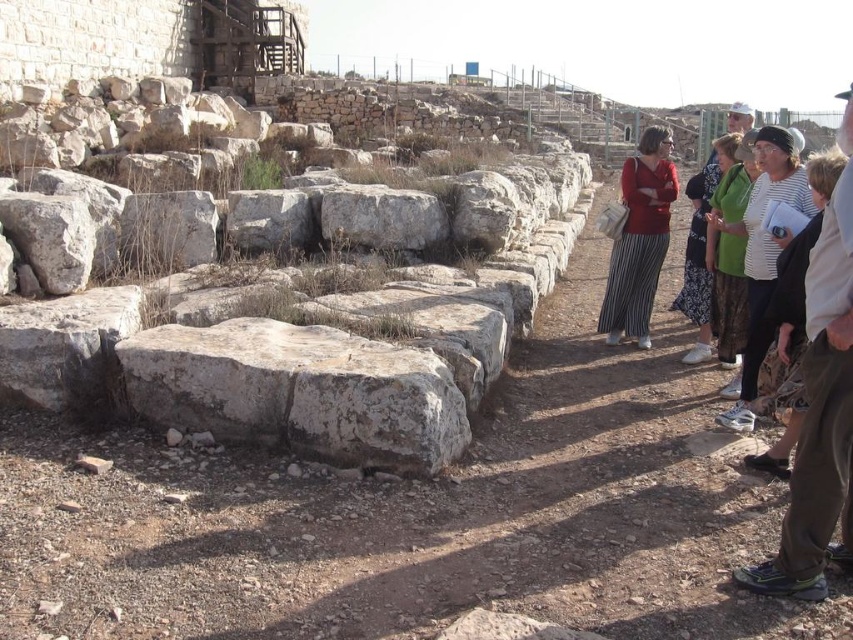
Question: Does gray stone boulder at left have a lesser width compared to striped fabric at right?

Choices:
 (A) no
 (B) yes

Answer: (A)

Question: Which object appears closest to the camera in this image?

Choices:
 (A) striped fabric jacket at right
 (B) green textured sweater at right
 (C) red matte sweater at center

Answer: (A)

Question: Is gray stone boulder at left behind striped fabric jacket at right?

Choices:
 (A) yes
 (B) no

Answer: (A)

Question: Which point is closer to the camera taking this photo?

Choices:
 (A) (848, 304)
 (B) (403, 294)
 (C) (635, 310)
 (D) (802, 211)

Answer: (A)

Question: Is gray stone boulder at left above striped fabric jacket at right?

Choices:
 (A) yes
 (B) no

Answer: (A)

Question: Which object appears farthest from the camera in this image?

Choices:
 (A) red matte sweater at center
 (B) green cotton dress at center
 (C) green textured sweater at right
 (D) striped fabric jacket at right

Answer: (A)